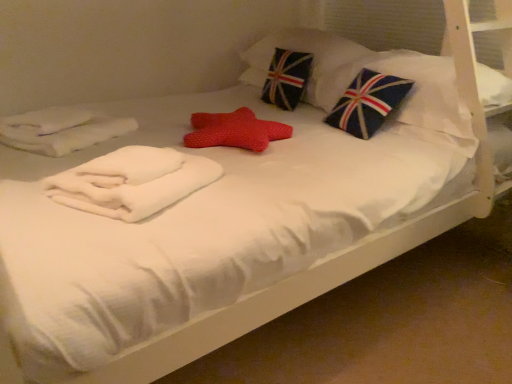
Question: Does union jack fabric pillow at upper center, marked as the 1th pillow in a back-to-front arrangement, have a lesser width compared to white soft towel at center?

Choices:
 (A) yes
 (B) no

Answer: (B)

Question: Can you confirm if union jack fabric pillow at upper center, which ranks as the 2th pillow in front-to-back order, is wider than white soft towel at center?

Choices:
 (A) yes
 (B) no

Answer: (A)

Question: From the image's perspective, would you say union jack fabric pillow at upper center, which ranks as the 2th pillow in front-to-back order, is positioned over white soft towel at center?

Choices:
 (A) yes
 (B) no

Answer: (A)

Question: Does union jack fabric pillow at upper center, which ranks as the 2th pillow in front-to-back order, have a lesser height compared to white soft towel at center?

Choices:
 (A) yes
 (B) no

Answer: (B)

Question: Is white soft towel at center surrounded by union jack fabric pillow at upper center, marked as the 1th pillow in a back-to-front arrangement?

Choices:
 (A) yes
 (B) no

Answer: (B)

Question: Considering their positions, is union jack fabric pillow at upper center, which ranks as the 2th pillow in front-to-back order, located in front of or behind white soft towel at center?

Choices:
 (A) behind
 (B) front

Answer: (A)

Question: Is union jack fabric pillow at upper center, marked as the 1th pillow in a back-to-front arrangement, wider or thinner than white soft towel at center?

Choices:
 (A) wide
 (B) thin

Answer: (A)

Question: Is union jack fabric pillow at upper center, marked as the 1th pillow in a back-to-front arrangement, situated inside white soft towel at center or outside?

Choices:
 (A) inside
 (B) outside

Answer: (B)

Question: Based on their positions, is union jack fabric pillow at upper center, which ranks as the 2th pillow in front-to-back order, located to the left or right of white soft towel at center?

Choices:
 (A) right
 (B) left

Answer: (A)

Question: Is blue fabric pillow with flag design at upper right, which is counted as the 1th pillow, starting from the front, bigger or smaller than white soft towel at center?

Choices:
 (A) small
 (B) big

Answer: (B)

Question: Which is correct: blue fabric pillow with flag design at upper right, which is counted as the 1th pillow, starting from the front, is inside white soft towel at center, or outside of it?

Choices:
 (A) inside
 (B) outside

Answer: (B)

Question: Is point (426, 127) positioned closer to the camera than point (163, 200)?

Choices:
 (A) farther
 (B) closer

Answer: (A)

Question: In the image, is blue fabric pillow with flag design at upper right, which is counted as the 1th pillow, starting from the front, on the left side or the right side of white soft towel at center?

Choices:
 (A) right
 (B) left

Answer: (A)

Question: In terms of height, does white soft towel at center look taller or shorter compared to blue fabric pillow with flag design at upper right, positioned as the second pillow in back-to-front order?

Choices:
 (A) tall
 (B) short

Answer: (B)

Question: From the image's perspective, relative to blue fabric pillow with flag design at upper right, which is counted as the 1th pillow, starting from the front, is white soft towel at center above or below?

Choices:
 (A) below
 (B) above

Answer: (A)